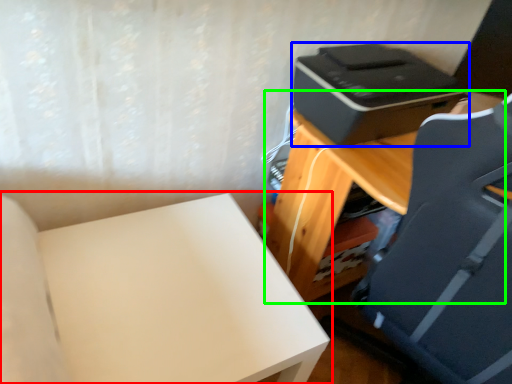
Question: Estimate the real-world distances between objects in this image. Which object is closer to furniture (highlighted by a red box), printer (highlighted by a blue box) or table (highlighted by a green box)?

Choices:
 (A) printer
 (B) table

Answer: (B)